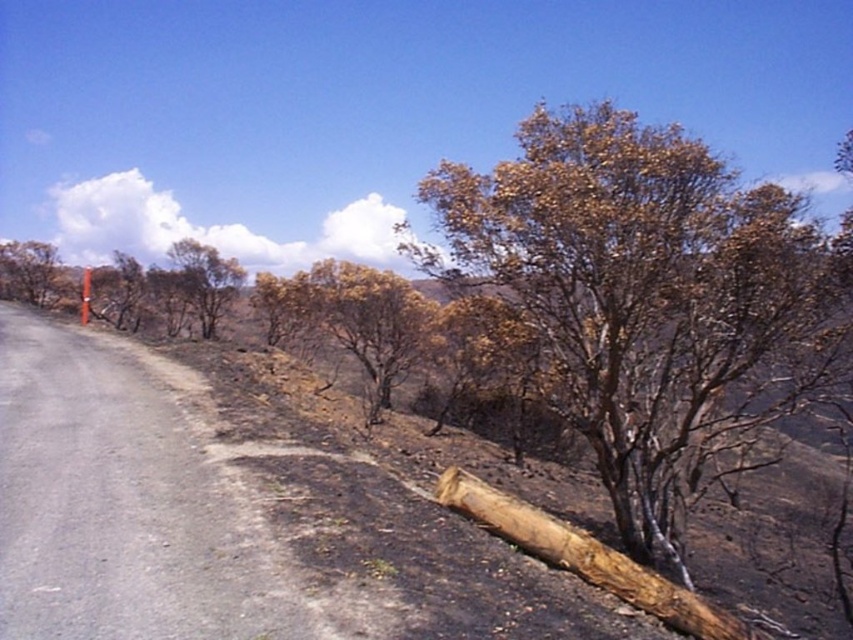
Who is taller, gray asphalt road at left or burnt brown tree at left?

burnt brown tree at left

Image resolution: width=853 pixels, height=640 pixels. Identify the location of gray asphalt road at left. (119, 506).

Measure the distance between brown/dried bark tree at right and camera.

brown/dried bark tree at right is 7.72 meters away from camera.

Who is more forward, [532,317] or [579,570]?

Positioned in front is point [579,570].

The image size is (853, 640). What do you see at coordinates (647, 298) in the screenshot?
I see `brown/dried bark tree at right` at bounding box center [647, 298].

Identify the location of brown/dried bark tree at right. (647, 298).

Is point (599, 176) behind point (195, 300)?

No, it is not.

Which is behind, point (590, 348) or point (209, 317)?

Point (209, 317)

At what (x,y) coordinates should I click in order to perform the action: click on brown/dried bark tree at right. Please return your answer as a coordinate pair (x, y). The width and height of the screenshot is (853, 640). Looking at the image, I should click on (647, 298).